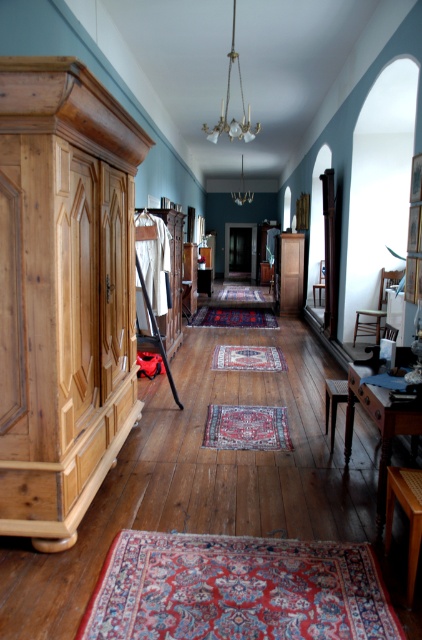
Which is more to the left, dark wood table at right or wooden table at lower right?

wooden table at lower right is more to the left.

Does dark wood table at right appear on the right side of wooden table at lower right?

Yes, dark wood table at right is to the right of wooden table at lower right.

Is point (384, 512) in front of point (389, 468)?

No, (384, 512) is further to viewer.

At what (x,y) coordinates should I click in order to perform the action: click on dark wood table at right. Please return your answer as a coordinate pair (x, y). This screenshot has height=640, width=422. Looking at the image, I should click on (378, 426).

Does wooden table at lower right appear under wooden chair at right?

Yes, wooden table at lower right is below wooden chair at right.

Is point (416, 497) farther from camera compared to point (359, 316)?

No, it is not.

From the picture: Who is more forward, (416, 509) or (392, 273)?

Positioned in front is point (416, 509).

Locate an element on the screen. wooden table at lower right is located at coordinates (406, 515).

Is point (370, 328) positioned after point (332, 387)?

Yes, point (370, 328) is farther from viewer.

What do you see at coordinates (376, 308) in the screenshot?
I see `wooden chair at right` at bounding box center [376, 308].

Locate an element on the screen. wooden chair at right is located at coordinates (376, 308).